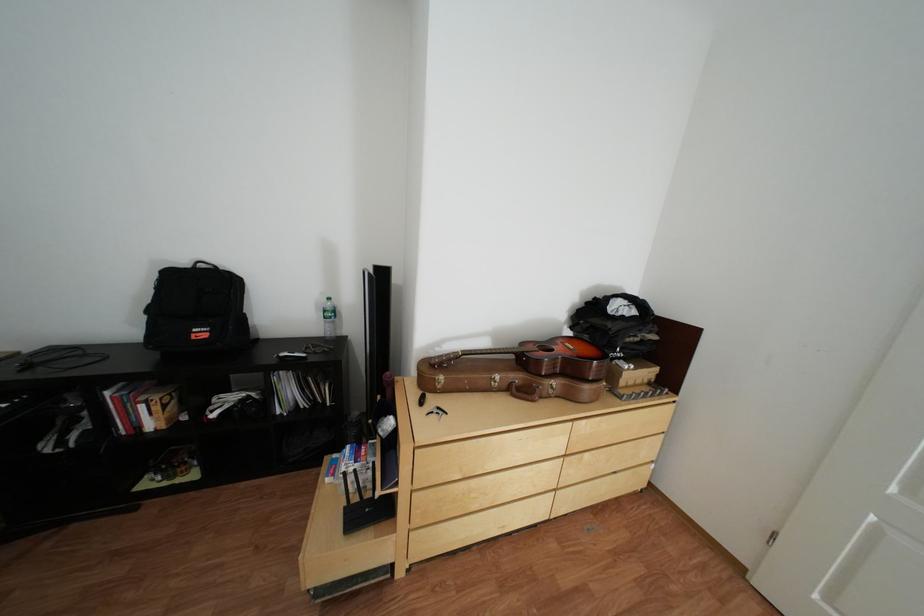
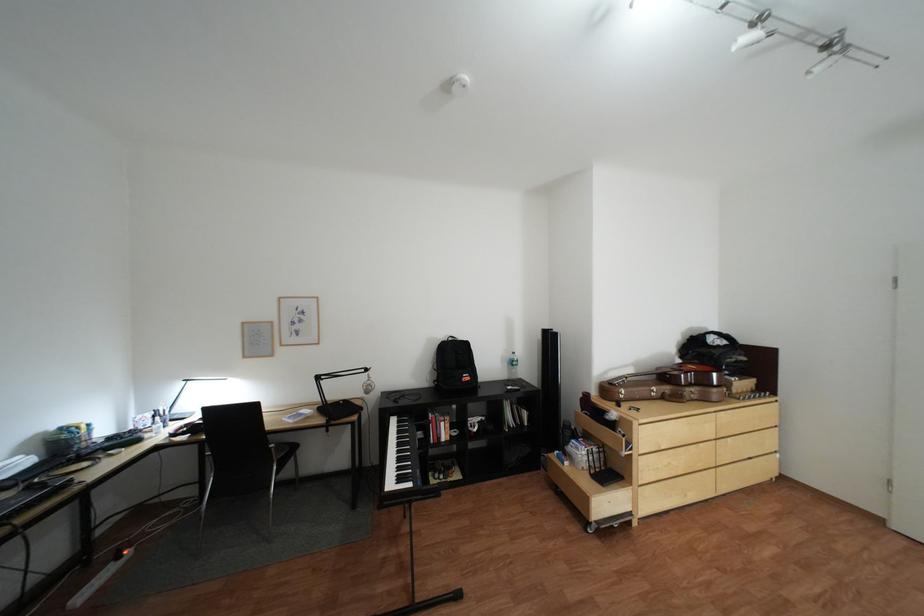
Locate, in the second image, the point that corresponds to (216,265) in the first image.

(466, 339)